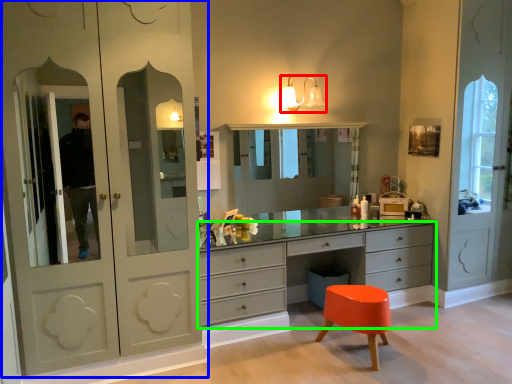
Question: Which object is the farthest from light fixture (highlighted by a red box)? Choose among these: cupboard (highlighted by a blue box) or chest of drawers (highlighted by a green box).

Choices:
 (A) cupboard
 (B) chest of drawers

Answer: (A)